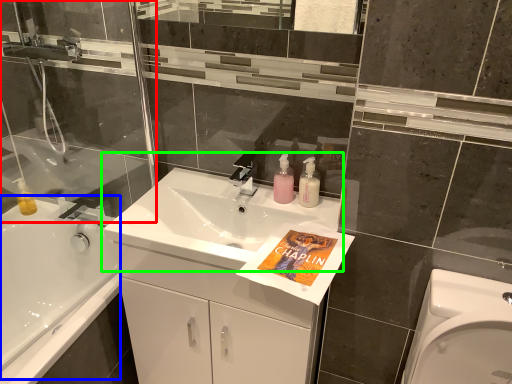
Question: Which object is the farthest from shower door (highlighted by a red box)? Choose among these: bath (highlighted by a blue box) or sink (highlighted by a green box).

Choices:
 (A) bath
 (B) sink

Answer: (B)